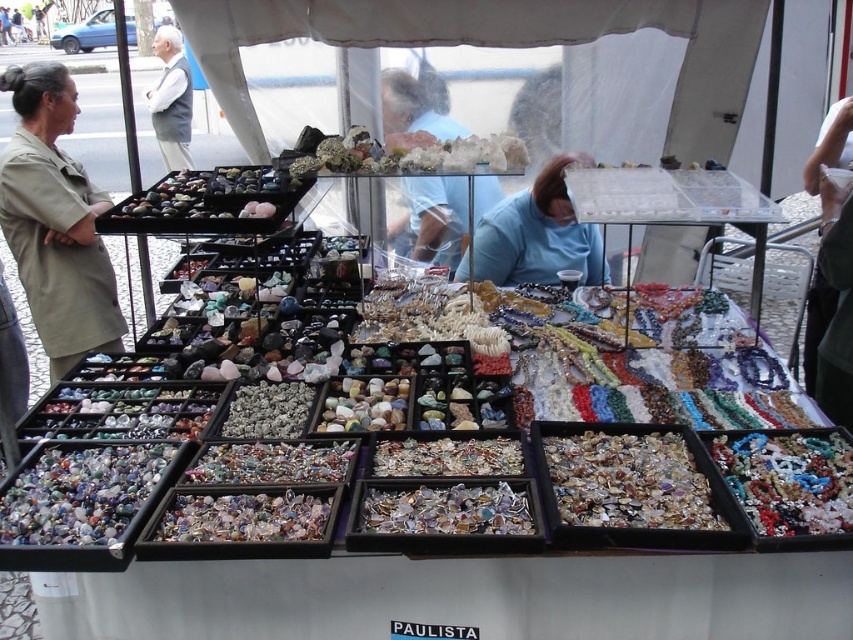
You are a customer at the market stall and want to buy the item that takes up less space. Which item should you choose between the beige uniform at left and the blue fabric at center?

The blue fabric at center takes up less space because it is smaller than the beige uniform at left.

You are a customer at the market stall and want to approach the vendor. Which clothing item should you look for to identify the vendor? The beige uniform at left or the white vest at upper left?

The vendor is likely wearing the beige uniform at left, which has a lesser width compared to the white vest at upper left.

You are a customer at the market stall and want to find the beige uniform at left. Where should you look relative to the blue fabric at center?

The beige uniform at left is located below the blue fabric at center, so you should look downward from the blue fabric at center to find it.